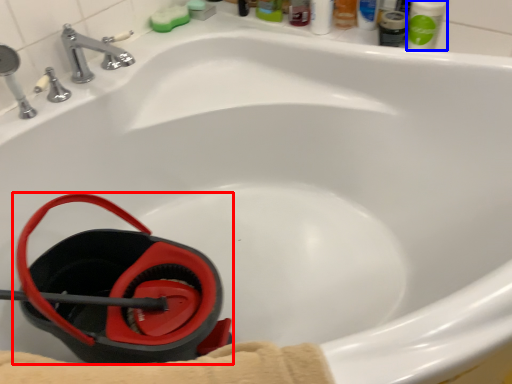
Question: Among these objects, which one is nearest to the camera, job (highlighted by a red box) or mouthwash (highlighted by a blue box)?

Choices:
 (A) job
 (B) mouthwash

Answer: (A)